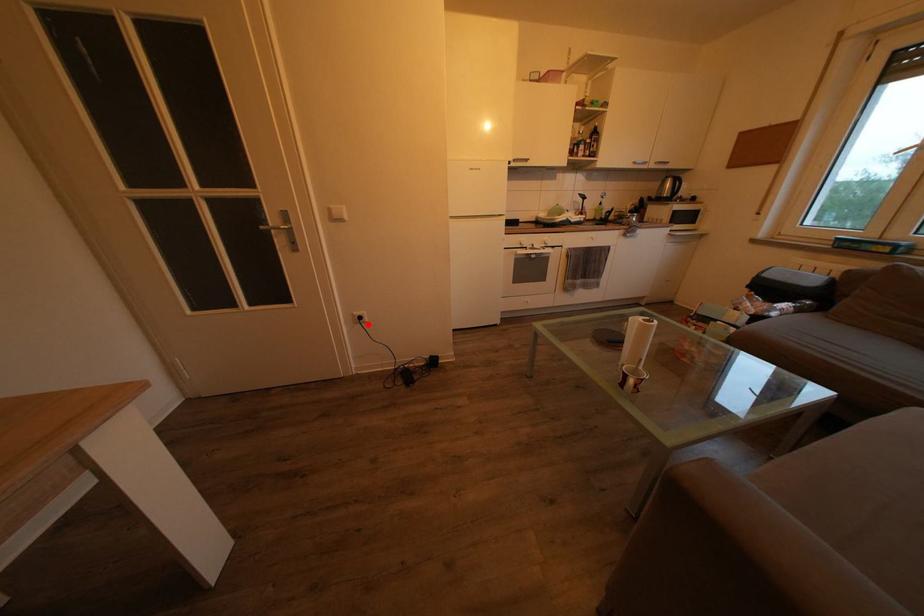
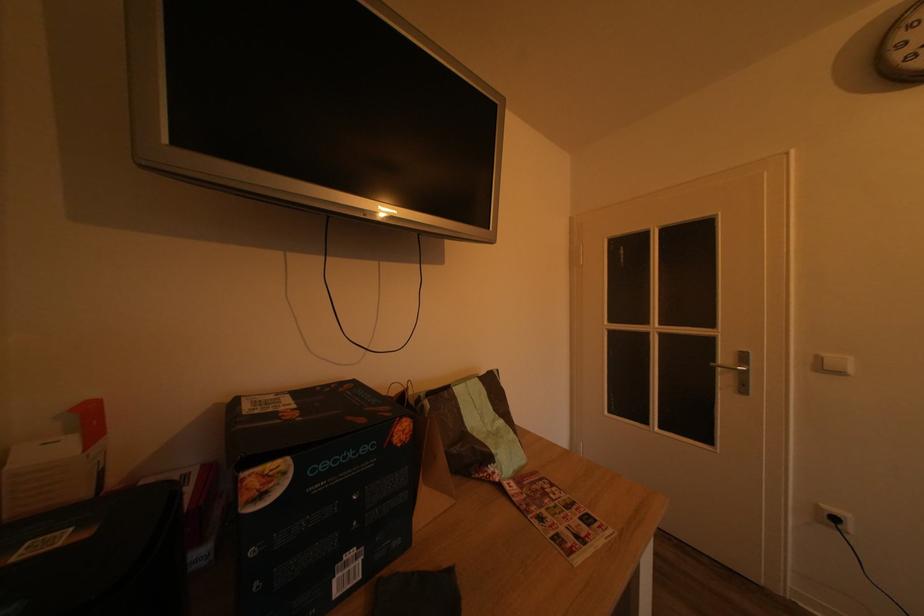
Question: I am providing you with two images of the same scene from different viewpoints. Given a red point in image1, look at the same physical point in image2. Is it:

Choices:
 (A) Closer to the viewpoint
 (B) Farther from the viewpoint

Answer: (A)